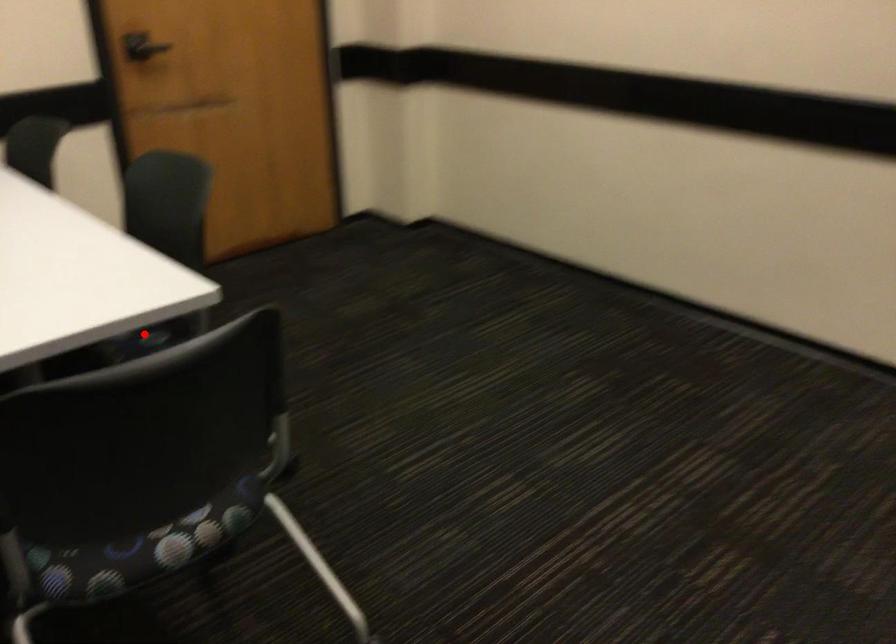
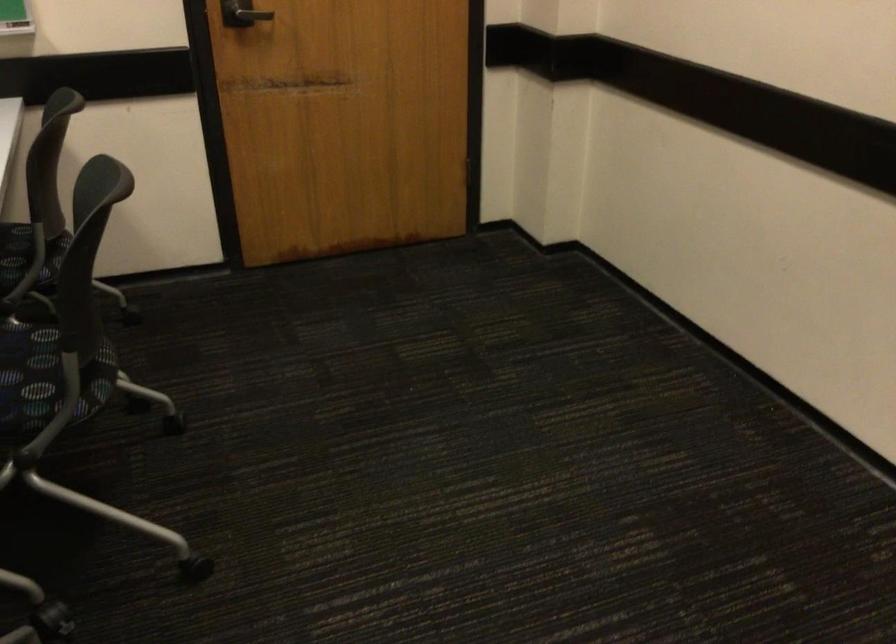
Where in the second image is the point corresponding to the highlighted location from the first image?

(47, 374)